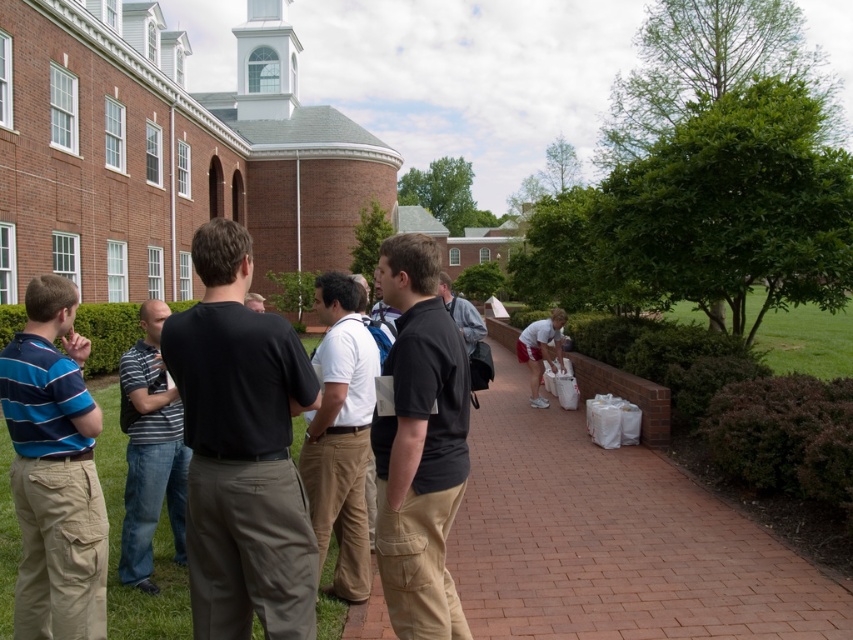
Question: Considering the relative positions of brick pathway at center and gray fabric jacket at center in the image provided, where is brick pathway at center located with respect to gray fabric jacket at center?

Choices:
 (A) right
 (B) left

Answer: (A)

Question: Which object is farther from the camera taking this photo?

Choices:
 (A) black cotton shirt at center
 (B) white cotton shirt at center
 (C) striped cotton shirt at left
 (D) blue striped shirt at left

Answer: (C)

Question: Which point is farther from the camera taking this photo?

Choices:
 (A) (553, 324)
 (B) (440, 291)

Answer: (A)

Question: Can you confirm if black cotton shirt at center is positioned above black matte shirt at center?

Choices:
 (A) yes
 (B) no

Answer: (A)

Question: Can you confirm if black matte shirt at center is thinner than white cotton shirt at center?

Choices:
 (A) yes
 (B) no

Answer: (A)

Question: Estimate the real-world distances between objects in this image. Which object is farther from the brick pathway at center?

Choices:
 (A) black cotton shirt at center
 (B) white cotton shirt at center

Answer: (A)